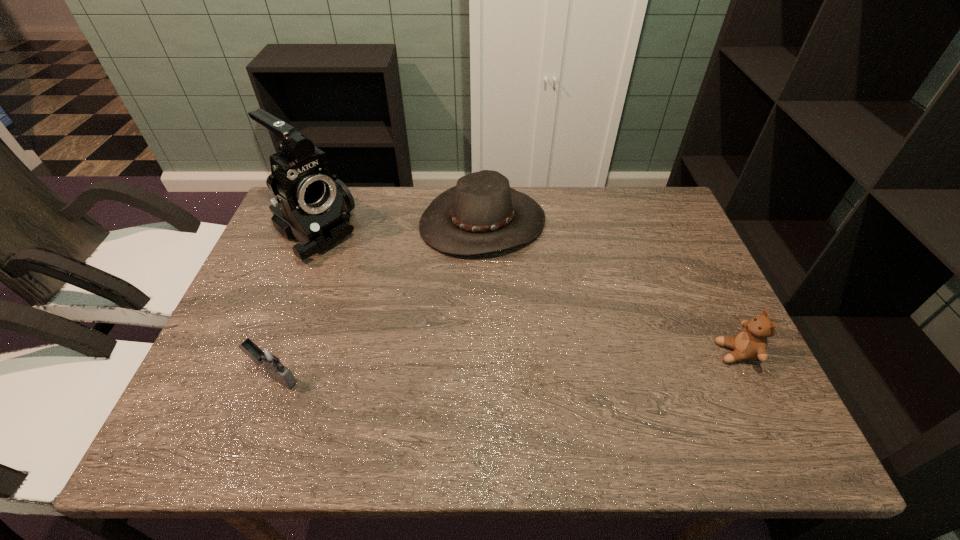
What are the coordinates of `vacant region between the camcorder and the teddy bear` in the screenshot? It's located at (525, 293).

I want to click on free space between the camcorder and the igniter, so click(294, 305).

The height and width of the screenshot is (540, 960). I want to click on empty space between the third object from left to right and the teddy bear, so click(610, 287).

Locate an element on the screen. The width and height of the screenshot is (960, 540). free area in between the tallest object and the second object from right to left is located at coordinates (398, 227).

Find the location of a particular element. unoccupied position between the third object from left to right and the tallest object is located at coordinates (398, 227).

At what (x,y) coordinates should I click in order to perform the action: click on free point between the tallest object and the hat. Please return your answer as a coordinate pair (x, y). The image size is (960, 540). Looking at the image, I should click on (398, 227).

Where is `free space that is in between the igniter and the second object from right to left`? This screenshot has width=960, height=540. free space that is in between the igniter and the second object from right to left is located at coordinates (378, 299).

The width and height of the screenshot is (960, 540). Identify the location of free space between the igniter and the tallest object. (294, 305).

You are a GUI agent. You are given a task and a screenshot of the screen. Output one action in this format:
    pyautogui.click(x=<x>, y=<y>)
    Task: Click on the free space between the igniter and the rightmost object
    This screenshot has width=960, height=540.
    Given the screenshot: What is the action you would take?
    pyautogui.click(x=505, y=364)

The height and width of the screenshot is (540, 960). What are the coordinates of `free space between the igniter and the camcorder` in the screenshot? It's located at (294, 305).